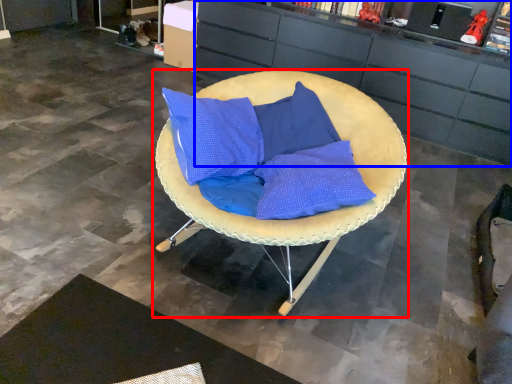
Question: Which point is closer to the camera, chair (highlighted by a red box) or cabinetry (highlighted by a blue box)?

Choices:
 (A) chair
 (B) cabinetry

Answer: (A)